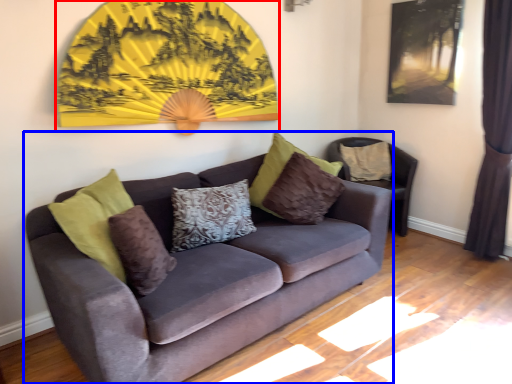
Question: Which of the following is the closest to the observer, decor (highlighted by a red box) or studio couch (highlighted by a blue box)?

Choices:
 (A) decor
 (B) studio couch

Answer: (B)